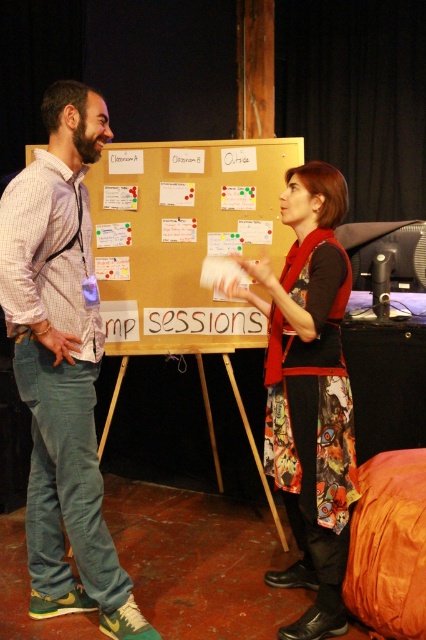
Can you confirm if matte plaid shirt at left is positioned below printed fabric dress at center?

No, matte plaid shirt at left is not below printed fabric dress at center.

Who is taller, matte plaid shirt at left or printed fabric dress at center?

Standing taller between the two is matte plaid shirt at left.

The width and height of the screenshot is (426, 640). I want to click on matte plaid shirt at left, so click(63, 364).

Image resolution: width=426 pixels, height=640 pixels. What do you see at coordinates (184, 237) in the screenshot? I see `gold matte bulletin board at center` at bounding box center [184, 237].

You are a GUI agent. You are given a task and a screenshot of the screen. Output one action in this format:
    pyautogui.click(x=<x>, y=<y>)
    Task: Click on the gold matte bulletin board at center
    This screenshot has width=426, height=640.
    Given the screenshot: What is the action you would take?
    [184, 237]

Where is `gold matte bulletin board at center`? This screenshot has height=640, width=426. gold matte bulletin board at center is located at coordinates (184, 237).

The height and width of the screenshot is (640, 426). What do you see at coordinates (63, 364) in the screenshot?
I see `matte plaid shirt at left` at bounding box center [63, 364].

Does point (45, 524) lie in front of point (135, 244)?

Yes, it is.

Where is `matte plaid shirt at left`? The image size is (426, 640). matte plaid shirt at left is located at coordinates (63, 364).